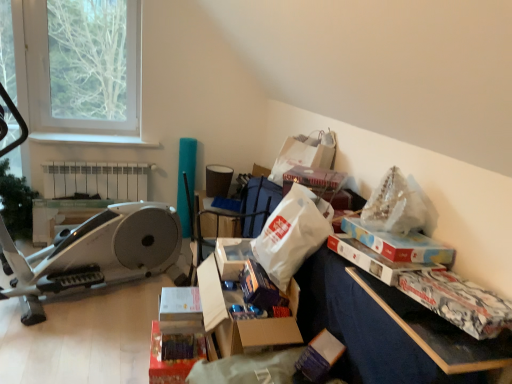
Question: Does white paper bag at upper center, which is the 3th paper bag from front to back, have a smaller size compared to white plastic radiator at upper left?

Choices:
 (A) no
 (B) yes

Answer: (B)

Question: Is white paper bag at upper center, which is the 3th paper bag from front to back, facing towards white plastic radiator at upper left?

Choices:
 (A) no
 (B) yes

Answer: (A)

Question: From a real-world perspective, is white paper bag at upper center, the first paper bag positioned from the back, physically below white plastic radiator at upper left?

Choices:
 (A) no
 (B) yes

Answer: (A)

Question: Is white paper bag at upper center, which is the 3th paper bag from front to back, next to white plastic radiator at upper left and touching it?

Choices:
 (A) yes
 (B) no

Answer: (B)

Question: Is white paper bag at upper center, which is the 3th paper bag from front to back, further to camera compared to white plastic radiator at upper left?

Choices:
 (A) yes
 (B) no

Answer: (B)

Question: From the image's perspective, is white paper bag at upper center, the first paper bag positioned from the back, above white plastic radiator at upper left?

Choices:
 (A) no
 (B) yes

Answer: (B)

Question: Could you tell me if matte cardboard storage box at center, which ranks as the first storage box in left-to-right order, is facing white paper bag at upper center, the first paper bag positioned from the back?

Choices:
 (A) yes
 (B) no

Answer: (B)

Question: Is matte cardboard storage box at center, which is the 2th storage box from top to bottom, to the right of white paper bag at upper center, the first paper bag positioned from the back, from the viewer's perspective?

Choices:
 (A) yes
 (B) no

Answer: (B)

Question: Considering the relative sizes of matte cardboard storage box at center, acting as the 1th storage box starting from the bottom, and white paper bag at upper center, the first paper bag positioned from the back, in the image provided, is matte cardboard storage box at center, acting as the 1th storage box starting from the bottom, bigger than white paper bag at upper center, the first paper bag positioned from the back,?

Choices:
 (A) no
 (B) yes

Answer: (A)

Question: Can you confirm if matte cardboard storage box at center, which is counted as the 2th storage box, starting from the right, is taller than white paper bag at upper center, the first paper bag positioned from the back?

Choices:
 (A) no
 (B) yes

Answer: (A)

Question: Considering the relative sizes of matte cardboard storage box at center, which is counted as the 2th storage box, starting from the right, and white paper bag at upper center, the first paper bag positioned from the back, in the image provided, is matte cardboard storage box at center, which is counted as the 2th storage box, starting from the right, thinner than white paper bag at upper center, the first paper bag positioned from the back,?

Choices:
 (A) yes
 (B) no

Answer: (A)

Question: From the image's perspective, would you say matte cardboard storage box at center, which is the 2th storage box from top to bottom, is shown under white paper bag at upper center, the first paper bag positioned from the back?

Choices:
 (A) yes
 (B) no

Answer: (A)

Question: From the image's perspective, would you say translucent plastic bag at upper right, which is the first paper bag from front to back, is positioned over white plastic radiator at upper left?

Choices:
 (A) no
 (B) yes

Answer: (A)